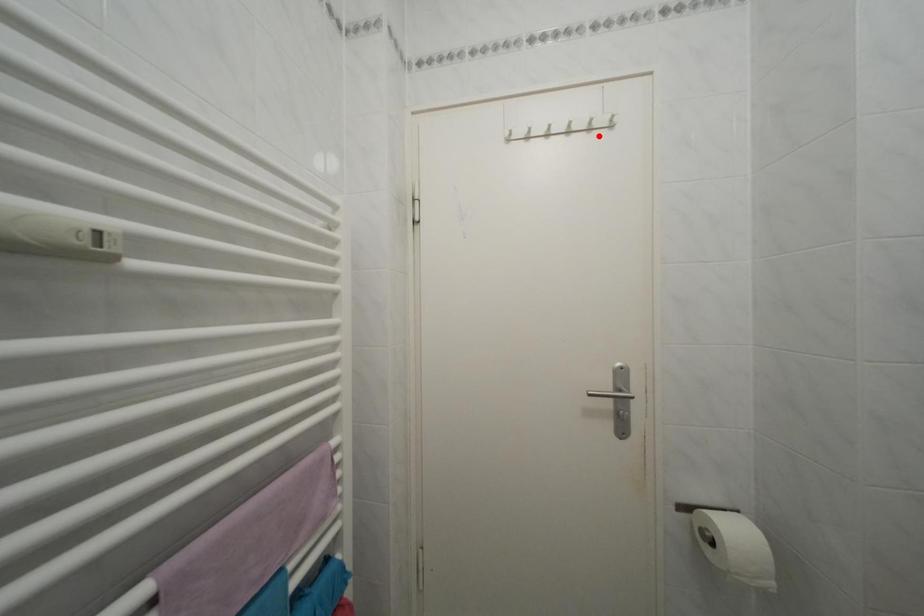
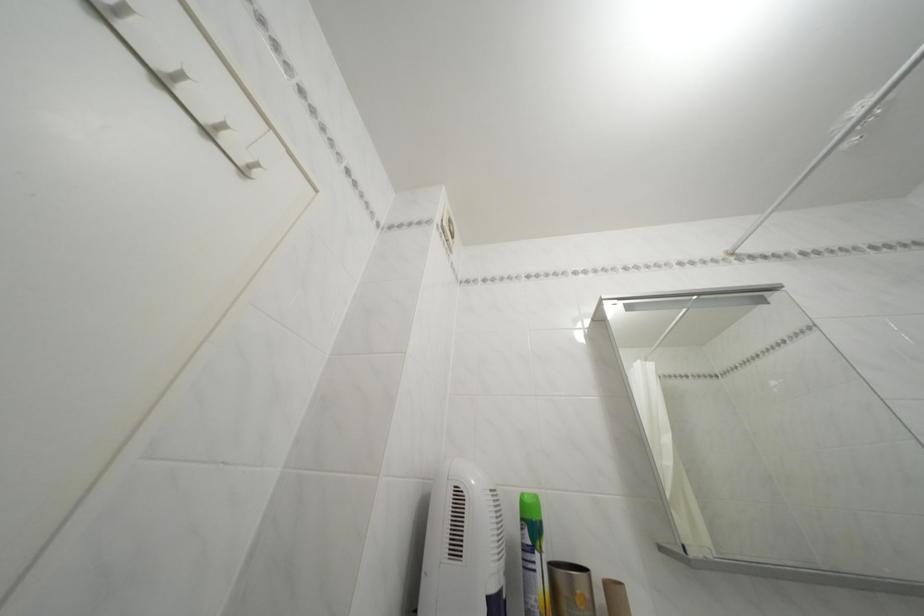
Where in the second image is the point corresponding to the highlighted location from the first image?

(216, 139)